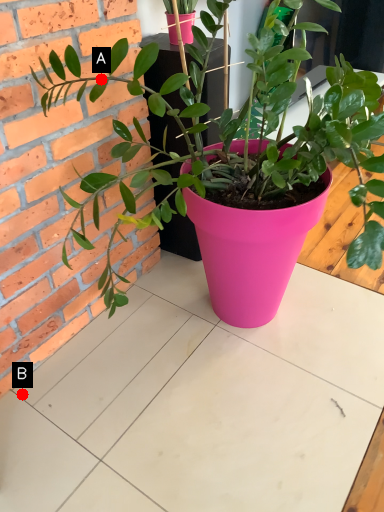
Question: Two points are circled on the image, labeled by A and B beside each circle. Which of the following is the closest to the observer?

Choices:
 (A) A is closer
 (B) B is closer

Answer: (A)